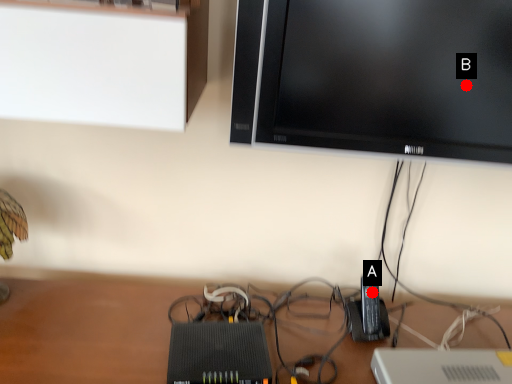
Question: Two points are circled on the image, labeled by A and B beside each circle. Which point appears closest to the camera in this image?

Choices:
 (A) A is closer
 (B) B is closer

Answer: (B)